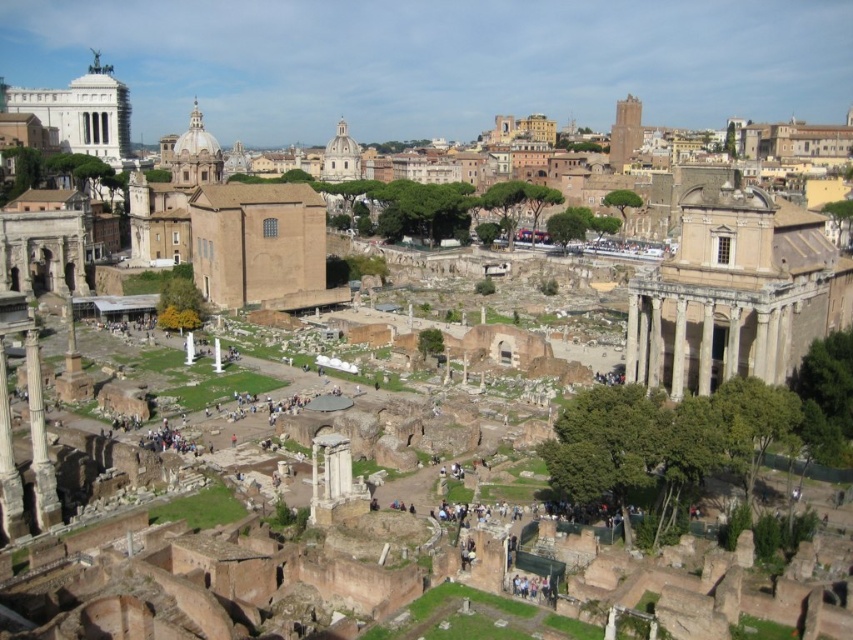
You are a tourist standing at the entrance of the Roman Forum. You see the beige stone temple at center right and the white marble column at left. Which object is closer to you?

The beige stone temple at center right is closer to you because the white marble column at left is behind it.

You are standing at the point labeled as point (735, 292) in the Roman Forum. What structure are you facing?

The point (735, 292) indicates that you are facing the beige stone temple at center right.

You are standing at the Roman Forum and want to take a photo of both point (757,294) and point (35,435) in the same frame. Which point is closer to the camera so that both can be in focus?

Point (35,435) is closer to the camera than point (757,294), so to ensure both are in focus, you should focus on the closer point (35,435) first.